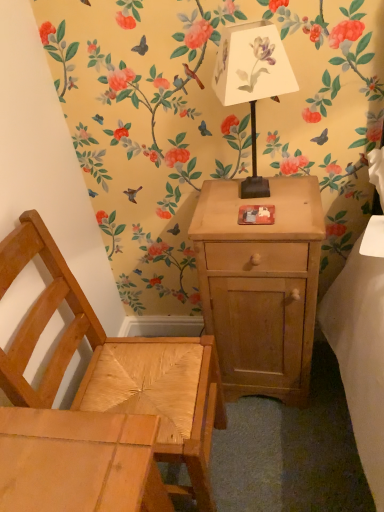
Question: Can you confirm if white paper lampshade at upper center is taller than natural wood chair at lower left?

Choices:
 (A) yes
 (B) no

Answer: (B)

Question: Is white paper lampshade at upper center to the left of natural wood chair at lower left from the viewer's perspective?

Choices:
 (A) no
 (B) yes

Answer: (A)

Question: From the image's perspective, is white paper lampshade at upper center on top of natural wood chair at lower left?

Choices:
 (A) no
 (B) yes

Answer: (B)

Question: Can we say white paper lampshade at upper center lies outside natural wood chair at lower left?

Choices:
 (A) yes
 (B) no

Answer: (A)

Question: Does white paper lampshade at upper center have a lesser height compared to natural wood chair at lower left?

Choices:
 (A) no
 (B) yes

Answer: (B)

Question: Does white paper lampshade at upper center lie behind natural wood chair at lower left?

Choices:
 (A) no
 (B) yes

Answer: (B)

Question: From the image's perspective, does light brown wood nightstand at center appear lower than natural wood chair at lower left?

Choices:
 (A) no
 (B) yes

Answer: (A)

Question: Considering the relative positions of light brown wood nightstand at center and natural wood chair at lower left in the image provided, is light brown wood nightstand at center to the left of natural wood chair at lower left from the viewer's perspective?

Choices:
 (A) yes
 (B) no

Answer: (B)

Question: From a real-world perspective, is light brown wood nightstand at center positioned over natural wood chair at lower left based on gravity?

Choices:
 (A) no
 (B) yes

Answer: (A)

Question: Is light brown wood nightstand at center not near natural wood chair at lower left?

Choices:
 (A) no
 (B) yes

Answer: (A)

Question: Does light brown wood nightstand at center lie behind natural wood chair at lower left?

Choices:
 (A) no
 (B) yes

Answer: (B)

Question: Can you confirm if light brown wood nightstand at center is thinner than natural wood chair at lower left?

Choices:
 (A) no
 (B) yes

Answer: (B)

Question: From a real-world perspective, is natural wood chair at lower left over light brown wood nightstand at center?

Choices:
 (A) yes
 (B) no

Answer: (A)